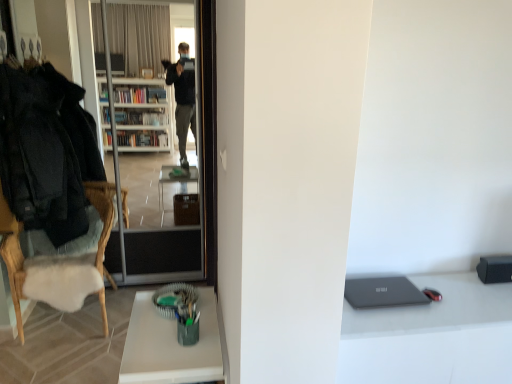
At what (x,y) coordinates should I click in order to perform the action: click on free area below white sheepskin cushion at left (from a real-world perspective). Please return your answer as a coordinate pair (x, y). Image resolution: width=512 pixels, height=384 pixels. Looking at the image, I should click on (70, 326).